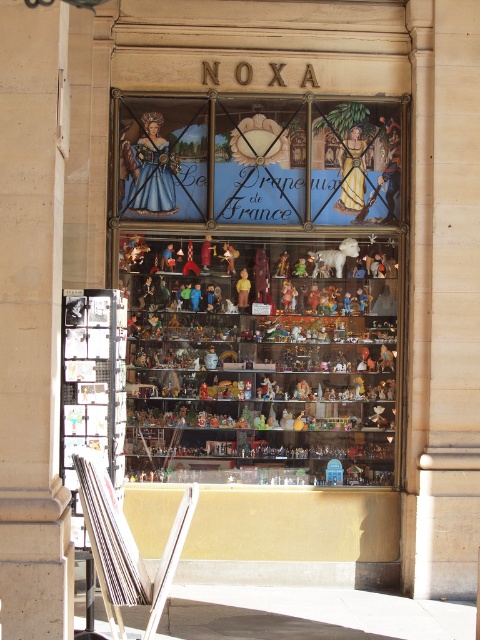
Consider the image. You are a customer standing in front of the NOXA shop window. You notice a point marked at coordinates (x=261, y=289). What can you see at that location?

At the point marked at coordinates (x=261, y=289), you can see multicolored figurines at center.

Looking at this image, you are a customer looking to purchase a gift for a child. You see the multicolored figurines at center and the white plush bear at center in the store window. Which item is taller?

The multicolored figurines at center are taller than the white plush bear at center.